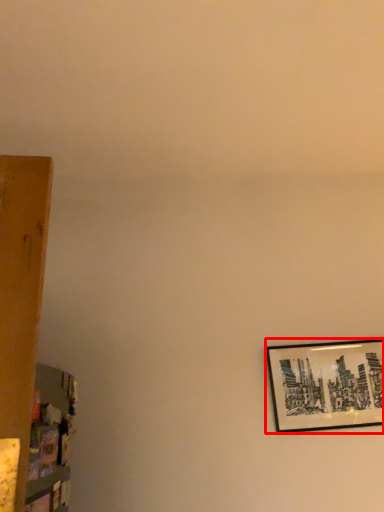
Question: From the image's perspective, considering the relative positions of picture frame (annotated by the red box) and shelf in the image provided, where is picture frame (annotated by the red box) located with respect to the staircase?

Choices:
 (A) below
 (B) above

Answer: (A)